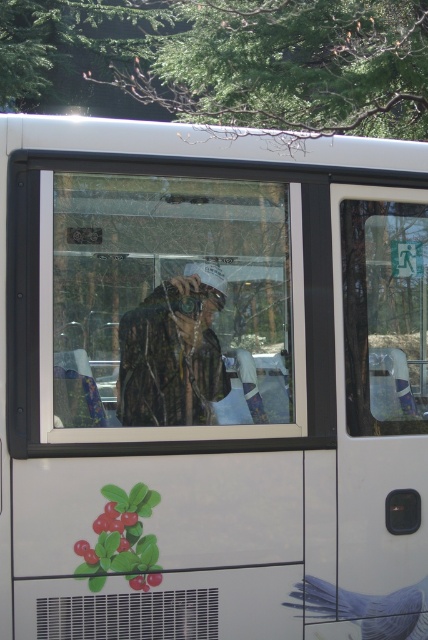
Can you confirm if transparent glass window at center is positioned to the left of smooth blue bird at lower right?

Indeed, transparent glass window at center is positioned on the left side of smooth blue bird at lower right.

This screenshot has height=640, width=428. What do you see at coordinates (169, 308) in the screenshot? I see `transparent glass window at center` at bounding box center [169, 308].

This screenshot has height=640, width=428. I want to click on transparent glass window at center, so click(x=169, y=308).

Which of these two, transparent glass window at center or transparent glass door at right, stands taller?

transparent glass window at center

Is point (226, 228) farther from camera compared to point (409, 388)?

No, it is not.

Who is more distant from viewer, (106, 195) or (353, 417)?

The point (353, 417) is more distant.

Identify the location of transparent glass window at center. This screenshot has height=640, width=428. (169, 308).

Does transparent glass door at right lie in front of smooth blue bird at lower right?

No, it is behind smooth blue bird at lower right.

Which of these two, transparent glass door at right or smooth blue bird at lower right, stands taller?

transparent glass door at right is taller.

Does point (368, 353) lie in front of point (326, 582)?

That is False.

Identify the location of transparent glass door at right. (385, 316).